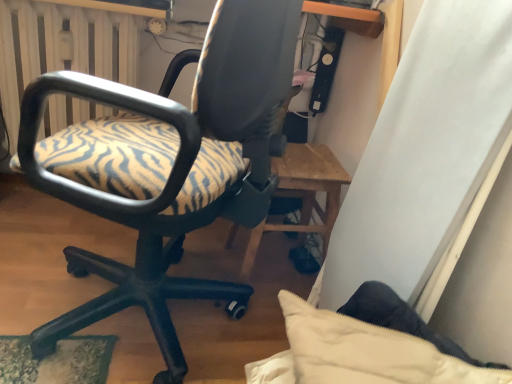
What do you see at coordinates (61, 47) in the screenshot?
I see `white radiator at upper left` at bounding box center [61, 47].

Measure the distance between white radiator at upper left and camera.

The distance of white radiator at upper left from camera is 4.43 feet.

This screenshot has height=384, width=512. Identify the location of white radiator at upper left. (61, 47).

Locate an element on the screen. zebra-patterned fabric office chair at left is located at coordinates (172, 168).

What do you see at coordinates (172, 168) in the screenshot? Image resolution: width=512 pixels, height=384 pixels. I see `zebra-patterned fabric office chair at left` at bounding box center [172, 168].

Measure the distance between zebra-patterned fabric office chair at left and camera.

zebra-patterned fabric office chair at left is 25.37 inches away from camera.

Where is `white radiator at upper left`? This screenshot has width=512, height=384. white radiator at upper left is located at coordinates (61, 47).

Between white radiator at upper left and zebra-patterned fabric office chair at left, which one appears on the left side from the viewer's perspective?

white radiator at upper left.

In the image, is white radiator at upper left positioned in front of or behind zebra-patterned fabric office chair at left?

Clearly, white radiator at upper left is behind zebra-patterned fabric office chair at left.

Considering the points (29, 53) and (84, 197), which point is in front, point (29, 53) or point (84, 197)?

Positioned in front is point (84, 197).

From the image's perspective, relative to zebra-patterned fabric office chair at left, is white radiator at upper left above or below?

From the image's perspective, white radiator at upper left appears above zebra-patterned fabric office chair at left.

From a real-world perspective, is white radiator at upper left on top of zebra-patterned fabric office chair at left?

Actually, white radiator at upper left is physically below zebra-patterned fabric office chair at left in the real world.

Can you confirm if white radiator at upper left is wider than zebra-patterned fabric office chair at left?

No, white radiator at upper left is not wider than zebra-patterned fabric office chair at left.

Which of these two, white radiator at upper left or zebra-patterned fabric office chair at left, stands shorter?

Standing shorter between the two is white radiator at upper left.

Considering the sizes of objects white radiator at upper left and zebra-patterned fabric office chair at left in the image provided, who is bigger, white radiator at upper left or zebra-patterned fabric office chair at left?

With larger size is zebra-patterned fabric office chair at left.

Does white radiator at upper left contain zebra-patterned fabric office chair at left?

No.

Is white radiator at upper left not near zebra-patterned fabric office chair at left?

Actually, white radiator at upper left and zebra-patterned fabric office chair at left are a little close together.

Is white radiator at upper left oriented away from zebra-patterned fabric office chair at left?

No.

Identify the location of chair to the right of white radiator at upper left. (172, 168).

Between zebra-patterned fabric office chair at left and white radiator at upper left, which one appears on the right side from the viewer's perspective?

Positioned to the right is zebra-patterned fabric office chair at left.

Between zebra-patterned fabric office chair at left and white radiator at upper left, which one is positioned in front?

zebra-patterned fabric office chair at left is closer to the camera.

Does point (88, 125) lie in front of point (124, 33)?

Yes, it is.

From the image's perspective, is zebra-patterned fabric office chair at left below white radiator at upper left?

Yes.

From a real-world perspective, is zebra-patterned fabric office chair at left above or below white radiator at upper left?

From a real-world perspective, zebra-patterned fabric office chair at left is physically above white radiator at upper left.

Considering the sizes of objects zebra-patterned fabric office chair at left and white radiator at upper left in the image provided, who is thinner, zebra-patterned fabric office chair at left or white radiator at upper left?

white radiator at upper left is thinner.

Considering the relative sizes of zebra-patterned fabric office chair at left and white radiator at upper left in the image provided, is zebra-patterned fabric office chair at left taller than white radiator at upper left?

Correct, zebra-patterned fabric office chair at left is much taller as white radiator at upper left.

Based on their sizes in the image, would you say zebra-patterned fabric office chair at left is bigger or smaller than white radiator at upper left?

Clearly, zebra-patterned fabric office chair at left is larger in size than white radiator at upper left.

Is white radiator at upper left a part of zebra-patterned fabric office chair at left?

No, white radiator at upper left is not surrounded by zebra-patterned fabric office chair at left.

Is zebra-patterned fabric office chair at left not near white radiator at upper left?

No, there isn't a large distance between zebra-patterned fabric office chair at left and white radiator at upper left.

Does zebra-patterned fabric office chair at left turn towards white radiator at upper left?

No, zebra-patterned fabric office chair at left is not aimed at white radiator at upper left.

Locate an element on the screen. The height and width of the screenshot is (384, 512). chair positioned vertically above the white radiator at upper left (from a real-world perspective) is located at coordinates (172, 168).

Locate an element on the screen. chair on the right of white radiator at upper left is located at coordinates (172, 168).

This screenshot has width=512, height=384. What are the coordinates of `radiator above the zebra-patterned fabric office chair at left (from the image's perspective)` in the screenshot? It's located at (61, 47).